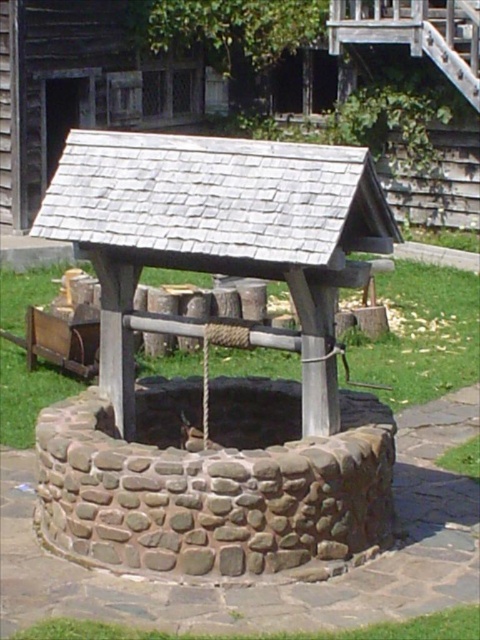
Question: Which of the following is the farthest from the observer?

Choices:
 (A) (108, 116)
 (B) (287, 387)

Answer: (A)

Question: Which point is closer to the camera?

Choices:
 (A) stone textured well at center
 (B) gray stone well at center

Answer: (B)

Question: In this image, where is gray stone well at center located relative to stone textured well at center?

Choices:
 (A) below
 (B) above

Answer: (A)

Question: Where is gray stone well at center located in relation to stone textured well at center in the image?

Choices:
 (A) left
 (B) right

Answer: (B)

Question: Is the position of gray stone well at center more distant than that of stone textured well at center?

Choices:
 (A) yes
 (B) no

Answer: (B)

Question: Which of the following is the closest to the observer?

Choices:
 (A) pyautogui.click(x=126, y=547)
 (B) pyautogui.click(x=131, y=64)

Answer: (A)